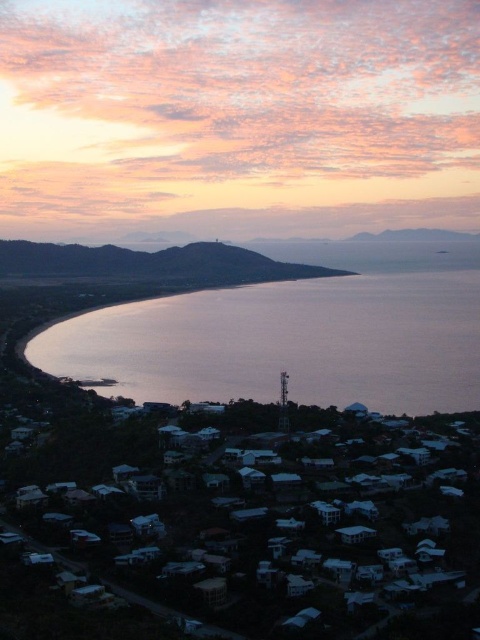
Does point (200, 400) come behind point (166, 273)?

No, it is in front of (166, 273).

Is silvery reflective water at center wider than matte brown hillside at center?

Yes, silvery reflective water at center is wider than matte brown hillside at center.

Find the location of a particular element. This screenshot has width=480, height=640. silvery reflective water at center is located at coordinates (288, 342).

Is pink cloud at upper center positioned in front of matte brown hillside at center?

No.

Is pink cloud at upper center taller than matte brown hillside at center?

Result: Indeed, pink cloud at upper center has a greater height compared to matte brown hillside at center.

Who is more distant from viewer, [441,208] or [340,273]?

The point [441,208] is behind.

Find the location of a particular element. The width and height of the screenshot is (480, 640). pink cloud at upper center is located at coordinates (238, 116).

Does pink cloud at upper center have a lesser height compared to silvery reflective water at center?

Incorrect, pink cloud at upper center's height does not fall short of silvery reflective water at center's.

Between pink cloud at upper center and silvery reflective water at center, which one is positioned lower?

silvery reflective water at center

What do you see at coordinates (238, 116) in the screenshot?
I see `pink cloud at upper center` at bounding box center [238, 116].

Where is `pink cloud at upper center`? Image resolution: width=480 pixels, height=640 pixels. pink cloud at upper center is located at coordinates (238, 116).